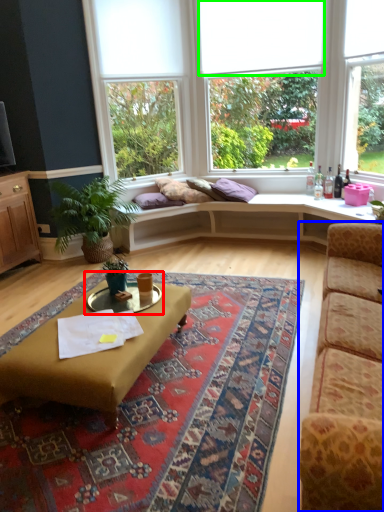
Question: Estimate the real-world distances between objects in this image. Which object is farther from cocktail table (highlighted by a red box), studio couch (highlighted by a blue box) or blind (highlighted by a green box)?

Choices:
 (A) studio couch
 (B) blind

Answer: (B)